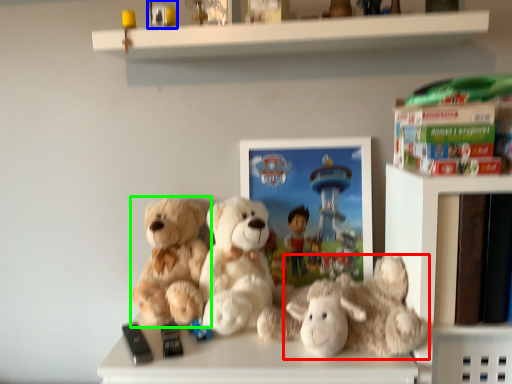
Question: Considering the real-world distances, which object is closest to teddy bear (highlighted by a red box)? toy (highlighted by a blue box) or teddy bear (highlighted by a green box).

Choices:
 (A) toy
 (B) teddy bear

Answer: (B)